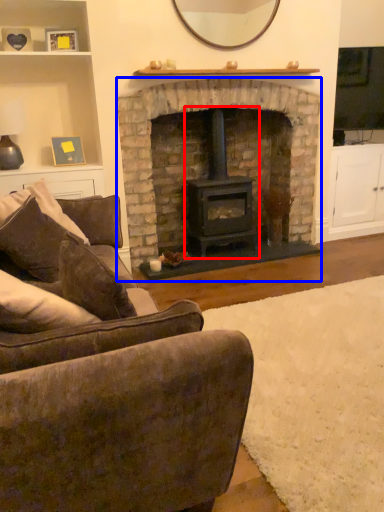
Question: Which of the following is the farthest to the observer, wood burning stove (highlighted by a red box) or fireplace (highlighted by a blue box)?

Choices:
 (A) wood burning stove
 (B) fireplace

Answer: (A)